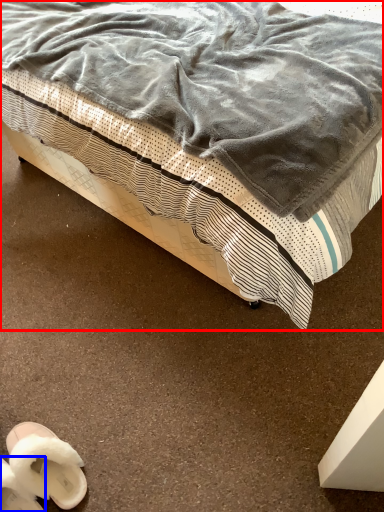
Question: Which point is further to the camera, bed (highlighted by a red box) or footwear (highlighted by a blue box)?

Choices:
 (A) bed
 (B) footwear

Answer: (B)